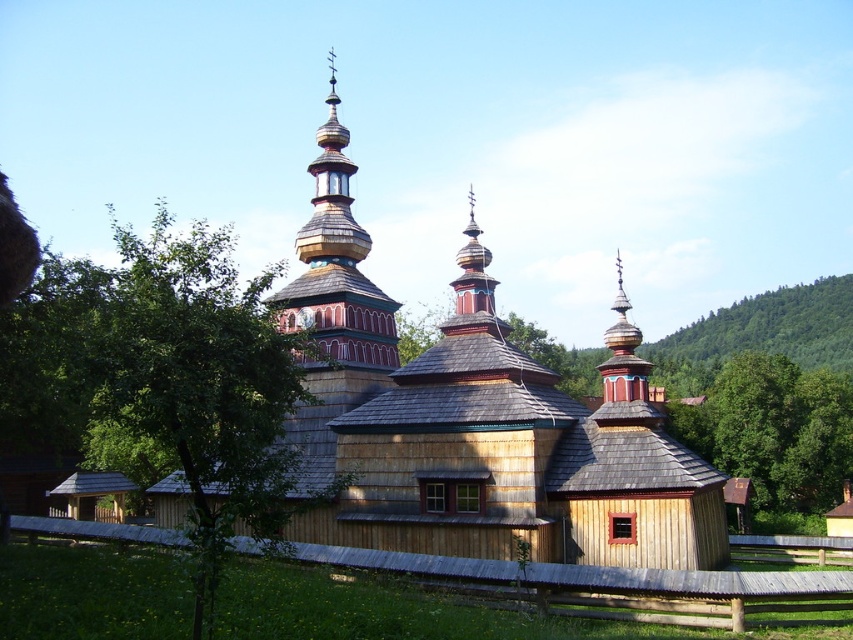
You are standing at the base of the green leafy tree at right and want to walk to the church entrance. The path is straight and clear. If you walk at a speed of 1.5 meters per second, how many seconds will it take you to reach the church entrance?

The distance between the green leafy tree at right and the viewer is 100.50 meters. Since you are starting at the tree and walking towards the church entrance, the time taken would be distance divided by speed. 100.50 meters divided by 1.5 meters per second equals 67 seconds. Therefore, it will take approximately 67 seconds to reach the church entrance.

You are standing in front of the traditional wooden church and want to take a photo. You notice two points marked on the church walls at coordinates point (567, 433) and point (732, 381). Which point will appear larger in your photo?

Point (567, 433) is closer to the camera than point (732, 381), so it will appear larger in the photo.